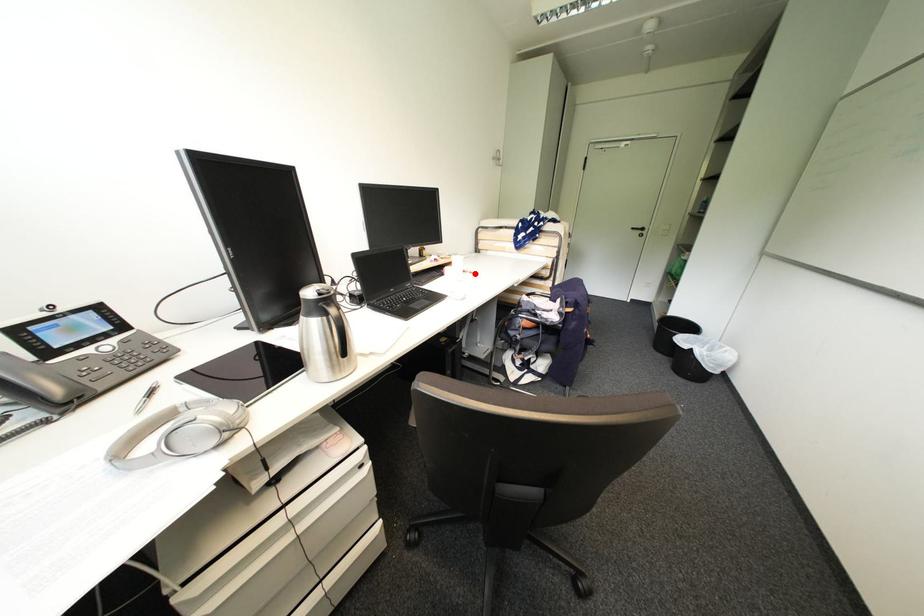
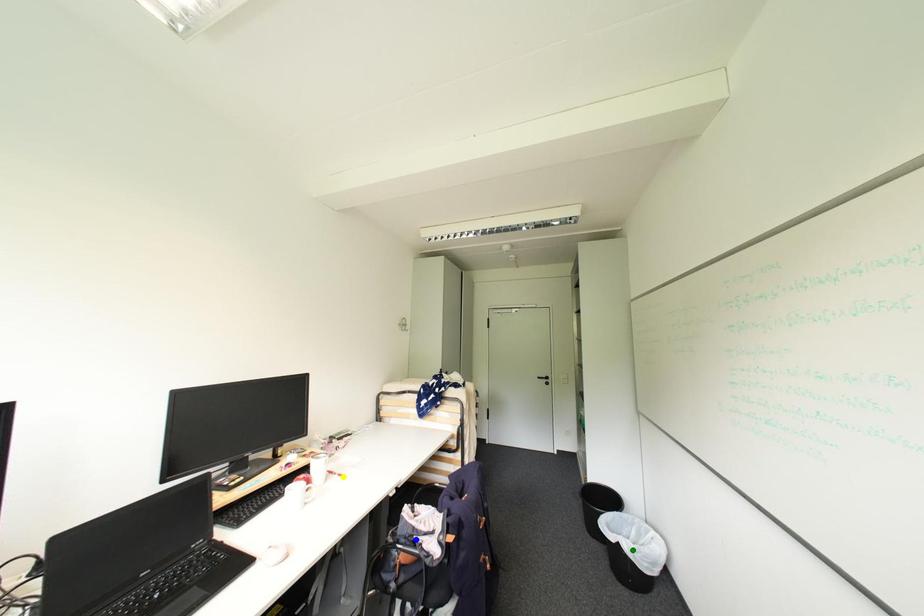
Question: I am providing you with two images of the same scene from different viewpoints. A red point is marked on the first image. You are given multiple points on the second image. Which spot in image 2 lines up with the point in image 1?

Choices:
 (A) yellow point
 (B) blue point
 (C) green point

Answer: (A)